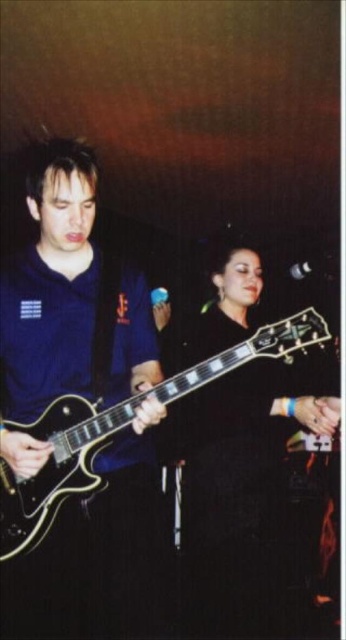
You are a stagehand setting up for a concert. You need to place a 36 inch wide amplifier between the matte black guitar at left and the shiny black guitar at center. Can you fit it without moving either guitar?

The distance between the matte black guitar at left and the shiny black guitar at center is 30.69 inches. Since the amplifier is 36 inches wide, which is wider than the space available, it cannot be placed between them without moving the guitars.

Consider the image. You are a photographer trying to capture a closeup of the guitarist and the person behind them. You notice two specific points in the image at coordinates point (x=252, y=545) and point (x=59, y=426). Which point is closer to your camera lens?

Point (x=252, y=545) is further to the viewer than point (x=59, y=426), so the point closer to the camera lens is point (x=59, y=426).

You are a stagehand setting up for a concert. You need to place the shiny black guitar at center and the black glossy electric guitar at center on a single stand that can only hold items up to 1.2 meters in height. Given their height difference, which guitar might not fit if the stand has limited vertical space?

The shiny black guitar at center has a greater height compared to the black glossy electric guitar at center, so the shiny black guitar at center might not fit on the stand if the stand has limited vertical space.